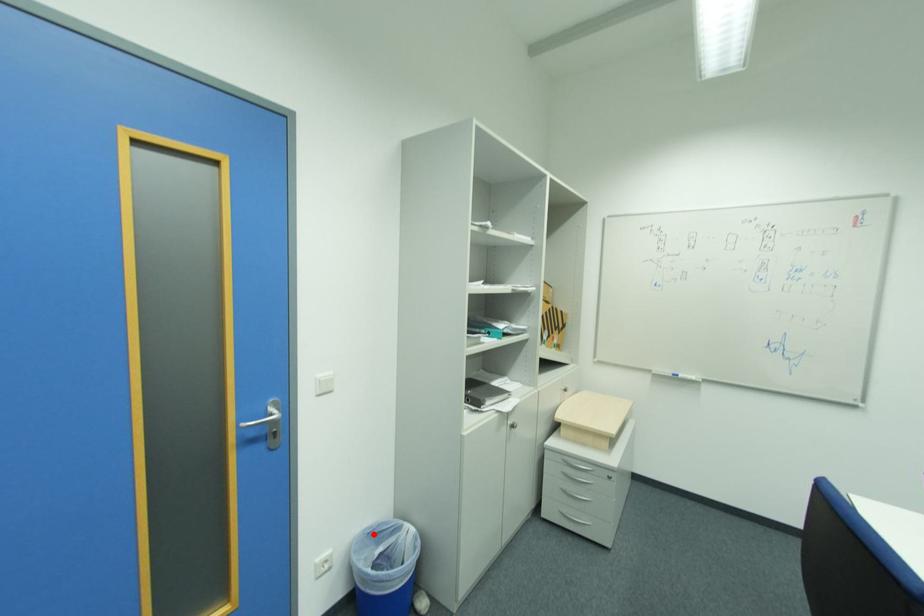
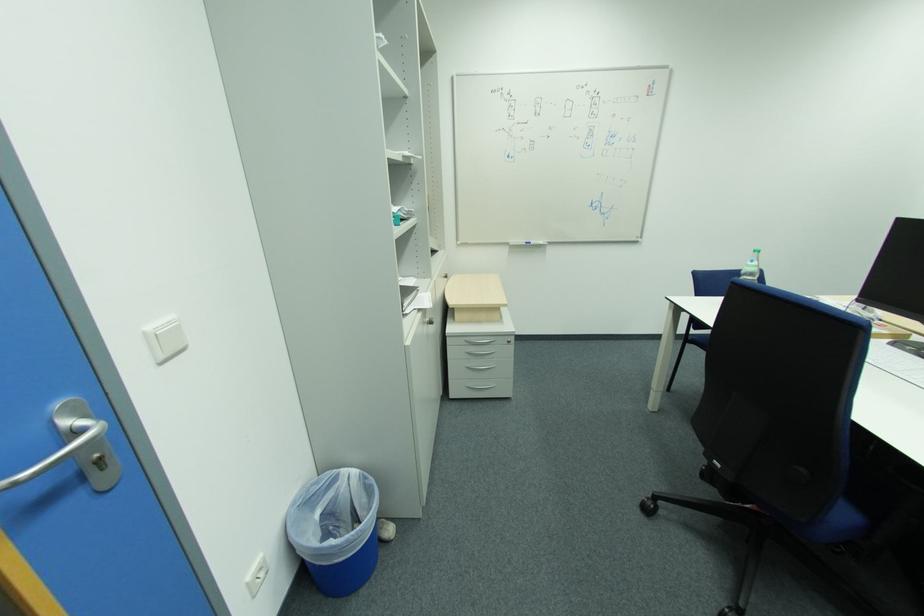
Locate, in the second image, the point that corresponds to the highlighted location in the first image.

(304, 507)